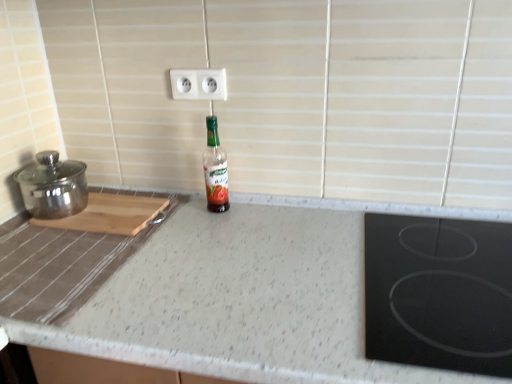
Question: In terms of width, does black glass cooktop at right look wider or thinner when compared to polished stainless steel pot at left?

Choices:
 (A) wide
 (B) thin

Answer: (A)

Question: Relative to polished stainless steel pot at left, is black glass cooktop at right in front or behind?

Choices:
 (A) behind
 (B) front

Answer: (B)

Question: Considering the real-world distances, which object is farthest from the white plastic electric outlet at upper center?

Choices:
 (A) speckled granite countertop at center
 (B) green glass bottle at center
 (C) polished stainless steel pot at left
 (D) black glass cooktop at right
 (E) wooden cutting board at left

Answer: (D)

Question: Which of these objects is positioned farthest from the green glass bottle at center?

Choices:
 (A) polished stainless steel pot at left
 (B) wooden cutting board at left
 (C) white plastic electric outlet at upper center
 (D) black glass cooktop at right
 (E) speckled granite countertop at center

Answer: (D)